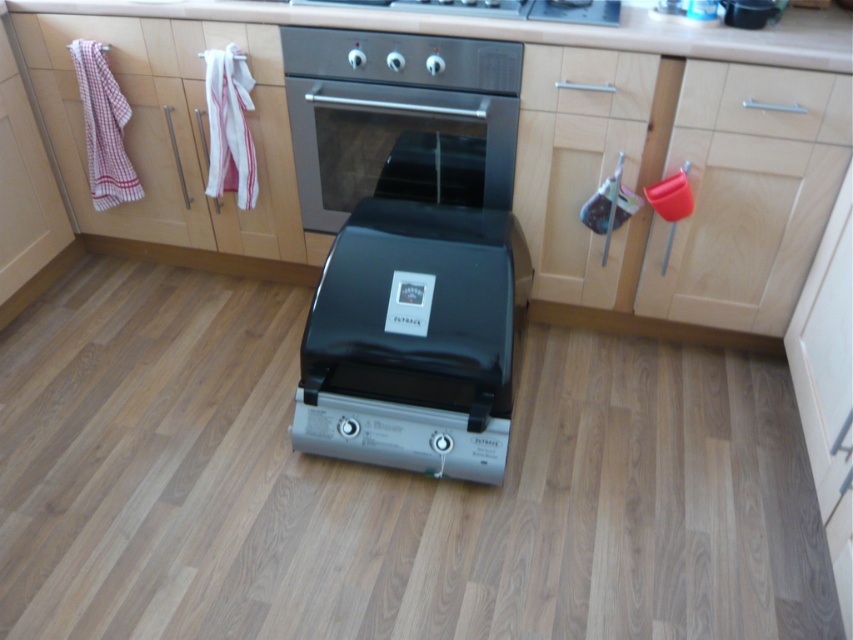
Question: Can you confirm if glossy ceramic countertop at upper center is positioned to the right of wooden drawer at center?

Choices:
 (A) no
 (B) yes

Answer: (A)

Question: From the image, what is the correct spatial relationship of silver metallic drawer at center in relation to satin silver oven at upper center?

Choices:
 (A) left
 (B) right

Answer: (B)

Question: Is the position of glossy ceramic countertop at upper center less distant than that of wooden drawer at center?

Choices:
 (A) no
 (B) yes

Answer: (B)

Question: Which object is positioned closest to the glossy ceramic countertop at upper center?

Choices:
 (A) black plastic grill at center
 (B) silver metallic drawer at center
 (C) satin silver oven at upper center
 (D) stainless steel oven at center

Answer: (C)

Question: Which of the following is the farthest from the observer?

Choices:
 (A) black plastic grill at center
 (B) silver metallic drawer at center
 (C) glossy ceramic countertop at upper center
 (D) stainless steel oven at center

Answer: (D)

Question: Which of the following is the farthest from the observer?

Choices:
 (A) (776, 122)
 (B) (645, 74)
 (C) (511, 8)
 (D) (717, 51)

Answer: (C)